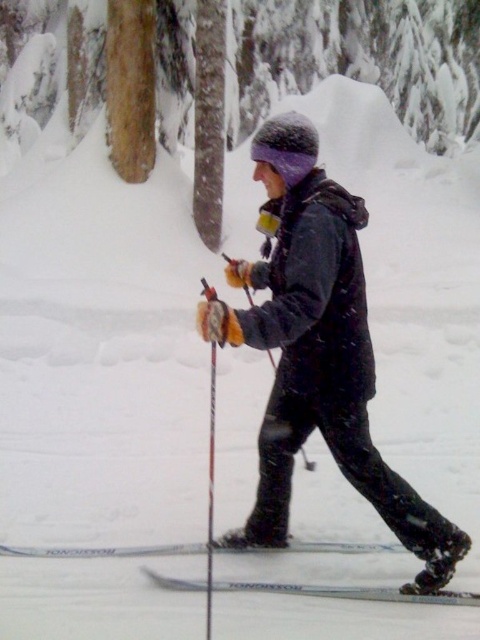
You are a photographer trying to capture the brown wood tree at center and the silver metallic ski at lower center in a single frame. Which object will appear larger in the photo?

The brown wood tree at center will appear larger in the photo because it is bigger than the silver metallic ski at lower center.

You are a photographer trying to capture the skier and the tree in the background. Since you want to include both the brown wood tree at center and the white metallic ski at lower center in your photo, which object should you focus on first to ensure both are in frame?

The brown wood tree at center is taller than the white metallic ski at lower center, so you should focus on the brown wood tree at center first to ensure both are in frame.

You are a photographer trying to capture the skier and the tree in the same frame. Since the silver metallic ski at lower center and the brown wood tree at center are in your view, which object is closer to you?

The brown wood tree at center is closer to you because the silver metallic ski at lower center is behind it.